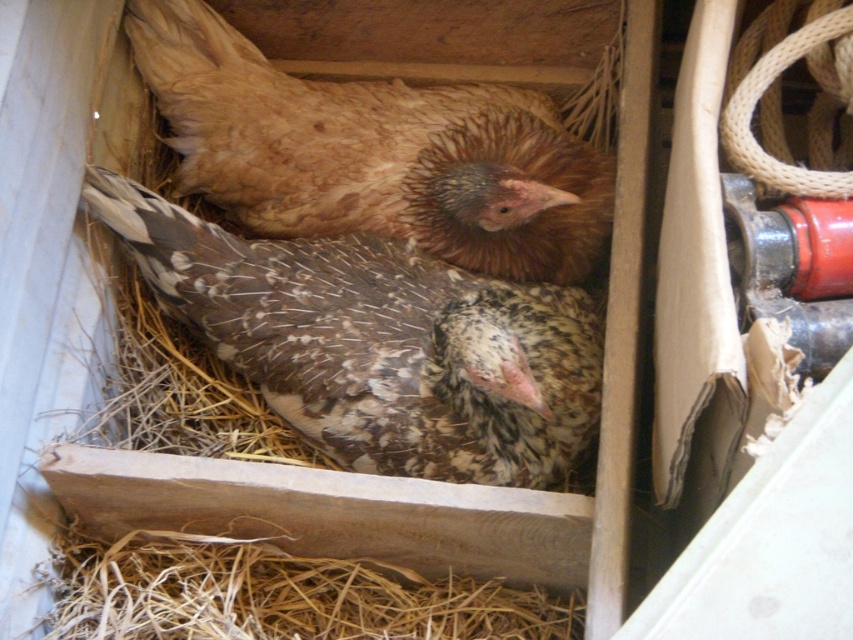
You are a farmer checking the nesting box. You need to determine which chicken is taller between the speckled feathered chicken at center and the brown speckled chicken at upper center. Which one is taller?

The speckled feathered chicken at center is taller than the brown speckled chicken at upper center according to the description.

You are a farmer checking the nesting box. You notice a point at coordinates (376, 342). What is located at that point?

At point (376, 342) lies the speckled feathered chicken at center.

You are a farmer checking the nesting box. You see the speckled feathered chicken at center and the brown speckled chicken at upper center. Which chicken is positioned higher up in the nesting box?

The brown speckled chicken at upper center is positioned higher up in the nesting box than the speckled feathered chicken at center.